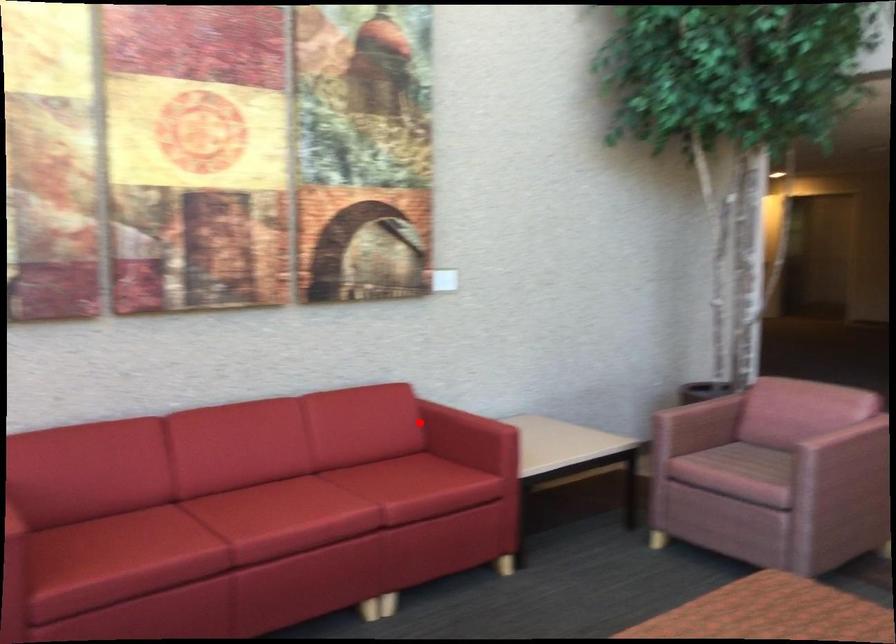
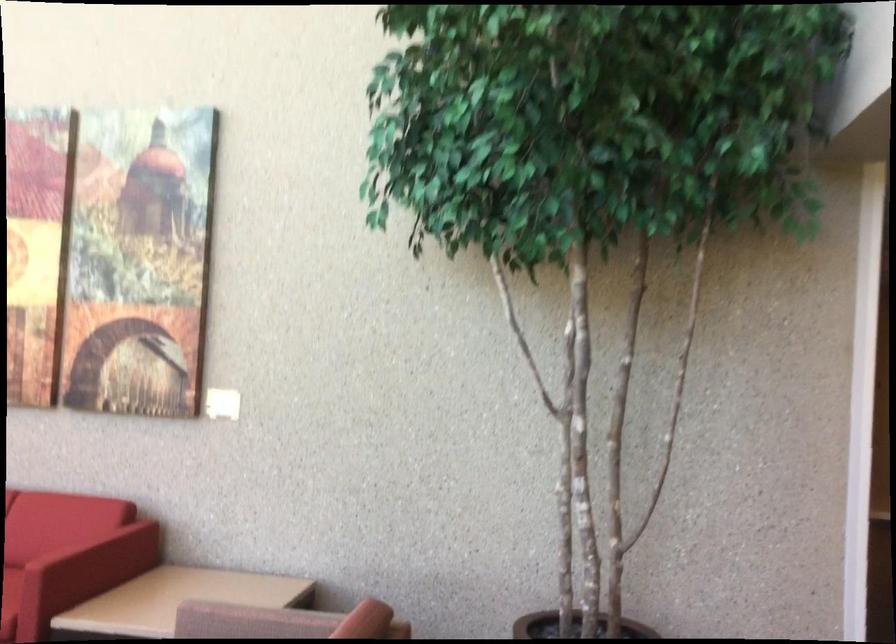
In the second image, find the point that corresponds to the highlighted location in the first image.

(80, 540)